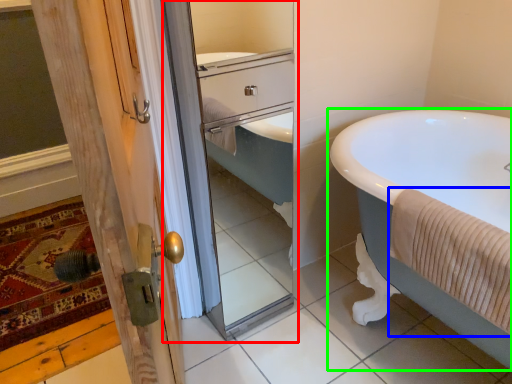
Question: Which is farther away from screen door (highlighted by a red box)? bath towel (highlighted by a blue box) or bathtub (highlighted by a green box)?

Choices:
 (A) bath towel
 (B) bathtub

Answer: (A)